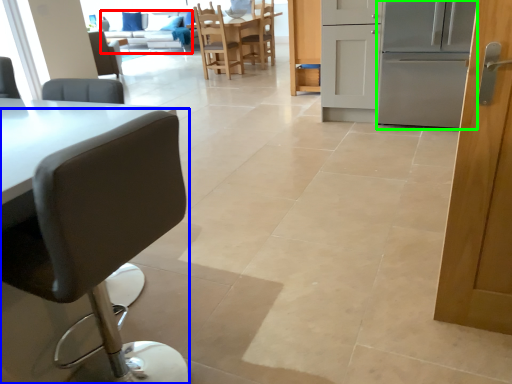
Question: Based on their relative distances, which object is farther from couch (highlighted by a red box)? Choose from chair (highlighted by a blue box) and oven (highlighted by a green box).

Choices:
 (A) chair
 (B) oven

Answer: (A)